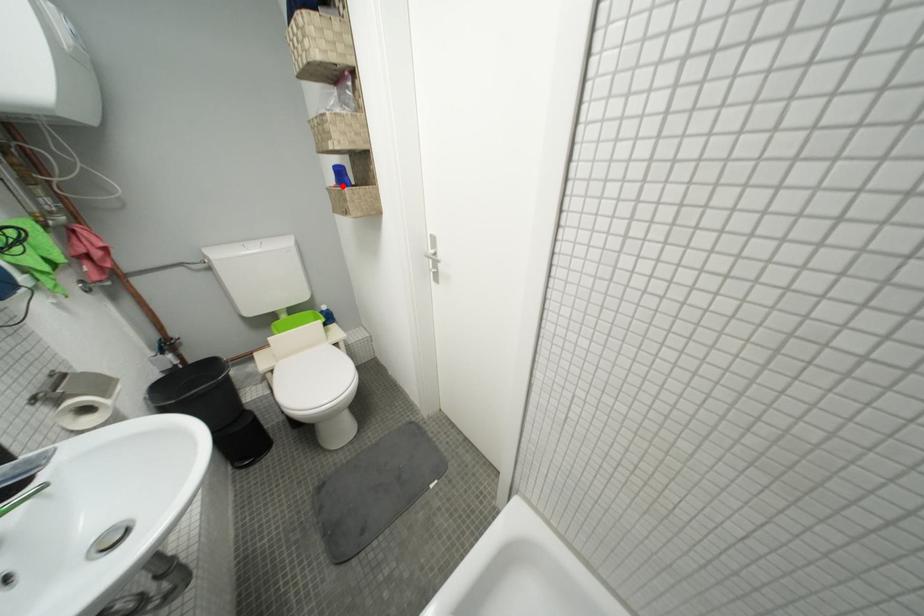
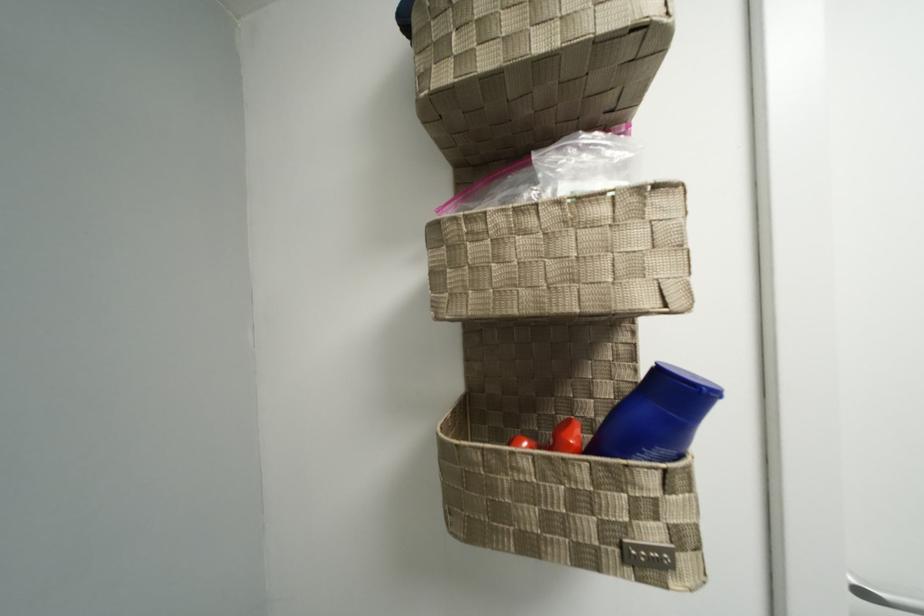
Locate, in the second image, the point that corresponds to the highlighted location in the first image.

(689, 450)